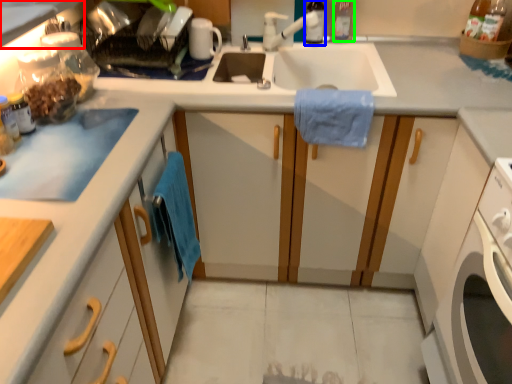
Question: Estimate the real-world distances between objects in this image. Which object is closer to countertop (highlighted by a red box), bottle (highlighted by a blue box) or bottle (highlighted by a green box)?

Choices:
 (A) bottle
 (B) bottle

Answer: (A)